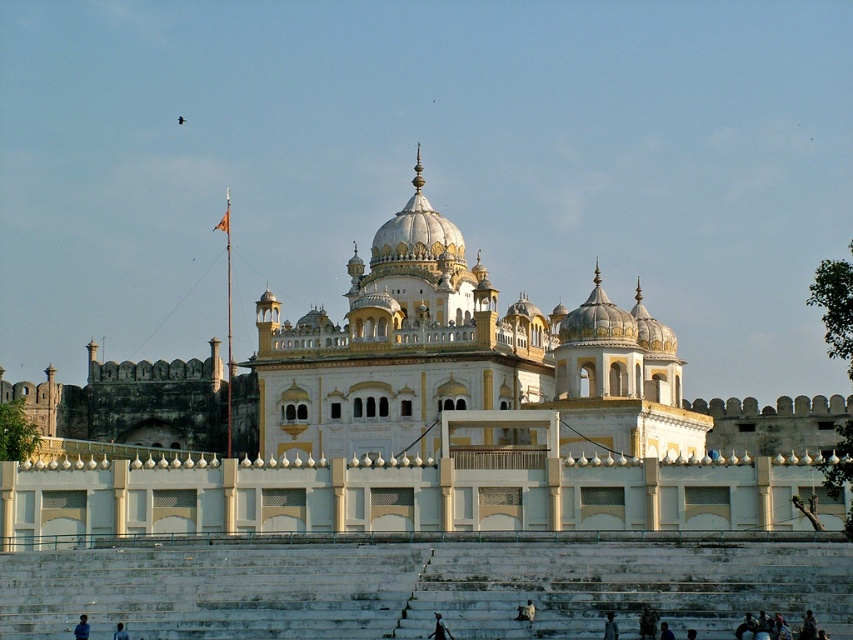
You are standing in front of a grand building with multiple domes. There is a point marked at coordinates [436,420]. Which object does this point correspond to?

The point at coordinates [436,420] corresponds to the white marble palace at center.